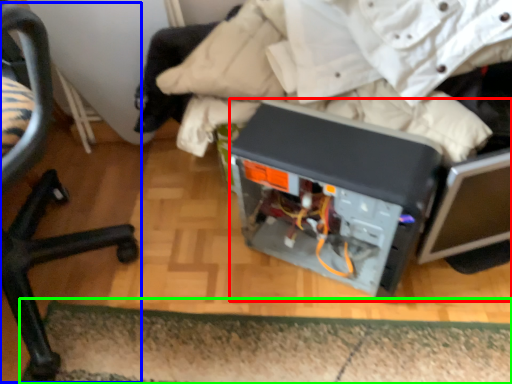
Question: Considering the real-world distances, which object is farthest from wide (highlighted by a red box)? chair (highlighted by a blue box) or doormat (highlighted by a green box)?

Choices:
 (A) chair
 (B) doormat

Answer: (A)